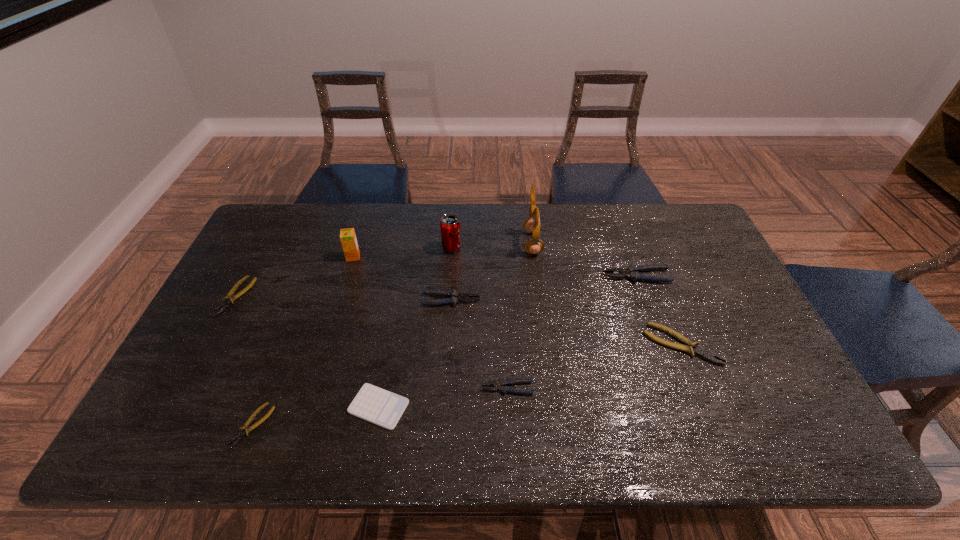
Where is `the third pliers from right to left`? The width and height of the screenshot is (960, 540). the third pliers from right to left is located at coordinates (504, 383).

You are a GUI agent. You are given a task and a screenshot of the screen. Output one action in this format:
    pyautogui.click(x=<x>, y=<y>)
    Task: Click on the second gray pliers from right to left
    Image resolution: width=960 pixels, height=540 pixels.
    Given the screenshot: What is the action you would take?
    pyautogui.click(x=504, y=383)

Locate an element on the screen. This screenshot has height=540, width=960. the leftmost pliers is located at coordinates (229, 298).

Image resolution: width=960 pixels, height=540 pixels. In order to click on the fifth tallest pliers in this screenshot , I will do `click(229, 298)`.

At what (x,y) coordinates should I click in order to perform the action: click on the seventh object from right to left. Please return your answer as a coordinate pair (x, y). Looking at the image, I should click on (384, 408).

The image size is (960, 540). I want to click on calculator, so (384, 408).

Image resolution: width=960 pixels, height=540 pixels. Identify the location of the shortest pliers. (245, 429).

The width and height of the screenshot is (960, 540). I want to click on the second pliers from left to right, so click(245, 429).

Locate an element on the screen. Image resolution: width=960 pixels, height=540 pixels. vacant region located on the front-facing side of the brown earphone is located at coordinates (440, 243).

The width and height of the screenshot is (960, 540). I want to click on vacant area located 0.400m on the front-facing side of the brown earphone, so click(x=403, y=243).